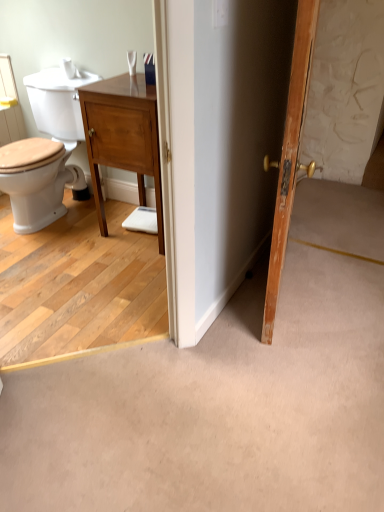
From the picture: Measure the distance between wooden door at right and camera.

They are 1.09 meters apart.

Describe the element at coordinates (290, 155) in the screenshot. The height and width of the screenshot is (512, 384). I see `wooden door at right` at that location.

At what (x,y) coordinates should I click in order to perform the action: click on wooden door at right. Please return your answer as a coordinate pair (x, y). The image size is (384, 512). Looking at the image, I should click on pos(290,155).

From the picture: What is the approximate width of wooden door at right?

wooden door at right is 4.54 inches in width.

This screenshot has width=384, height=512. What do you see at coordinates (123, 136) in the screenshot?
I see `light brown wood vanity at center` at bounding box center [123, 136].

Where is `light brown wood vanity at center`? light brown wood vanity at center is located at coordinates (123, 136).

Locate an element on the screen. Image resolution: width=384 pixels, height=512 pixels. wooden door at right is located at coordinates (290, 155).

Considering the relative positions of light brown wood vanity at center and wooden door at right in the image provided, is light brown wood vanity at center to the left or to the right of wooden door at right?

Based on their positions, light brown wood vanity at center is located to the left of wooden door at right.

Which object is further away from the camera, light brown wood vanity at center or wooden door at right?

Positioned behind is light brown wood vanity at center.

Considering the positions of point (154, 170) and point (300, 3), is point (154, 170) closer or farther from the camera than point (300, 3)?

Point (154, 170) appears to be farther away from the viewer than point (300, 3).

From the image's perspective, which one is positioned lower, light brown wood vanity at center or wooden door at right?

wooden door at right is shown below in the image.

From a real-world perspective, which object rests below the other?

light brown wood vanity at center.

In terms of width, does light brown wood vanity at center look wider or thinner when compared to wooden door at right?

Clearly, light brown wood vanity at center has more width compared to wooden door at right.

Between light brown wood vanity at center and wooden door at right, which one has less height?

light brown wood vanity at center.

Who is smaller, light brown wood vanity at center or wooden door at right?

wooden door at right is smaller.

Choose the correct answer: Is light brown wood vanity at center inside wooden door at right or outside it?

light brown wood vanity at center is outside wooden door at right.

Does light brown wood vanity at center touch wooden door at right?

No.

Is light brown wood vanity at center facing towards wooden door at right?

No, light brown wood vanity at center does not turn towards wooden door at right.

How different are the orientations of light brown wood vanity at center and wooden door at right in degrees?

104 degrees.

In order to click on door above the light brown wood vanity at center (from a real-world perspective) in this screenshot , I will do `click(290, 155)`.

Is wooden door at right to the right of light brown wood vanity at center from the viewer's perspective?

Indeed, wooden door at right is positioned on the right side of light brown wood vanity at center.

Who is more distant, wooden door at right or light brown wood vanity at center?

light brown wood vanity at center.

Which is closer to the camera, (282, 170) or (152, 109)?

Clearly, point (282, 170) is closer to the camera than point (152, 109).

From the image's perspective, which is below, wooden door at right or light brown wood vanity at center?

wooden door at right is shown below in the image.

From a real-world perspective, who is located lower, wooden door at right or light brown wood vanity at center?

From a 3D spatial view, light brown wood vanity at center is below.

Is wooden door at right wider or thinner than light brown wood vanity at center?

Clearly, wooden door at right has less width compared to light brown wood vanity at center.

Does wooden door at right have a lesser height compared to light brown wood vanity at center?

In fact, wooden door at right may be taller than light brown wood vanity at center.

Who is bigger, wooden door at right or light brown wood vanity at center?

light brown wood vanity at center is bigger.

Is light brown wood vanity at center inside wooden door at right?

No, wooden door at right does not contain light brown wood vanity at center.

Is wooden door at right next to light brown wood vanity at center and touching it?

No, wooden door at right is not in contact with light brown wood vanity at center.

Is wooden door at right aimed at light brown wood vanity at center?

No, wooden door at right is not oriented towards light brown wood vanity at center.

How many degrees apart are the facing directions of wooden door at right and light brown wood vanity at center?

wooden door at right and light brown wood vanity at center are facing 104 degrees away from each other.

Locate an element on the screen. door in front of the light brown wood vanity at center is located at coordinates (290, 155).

The height and width of the screenshot is (512, 384). What are the coordinates of `vanity that is above the wooden door at right (from the image's perspective)` in the screenshot? It's located at (123, 136).

The image size is (384, 512). Identify the location of door above the light brown wood vanity at center (from a real-world perspective). (290, 155).